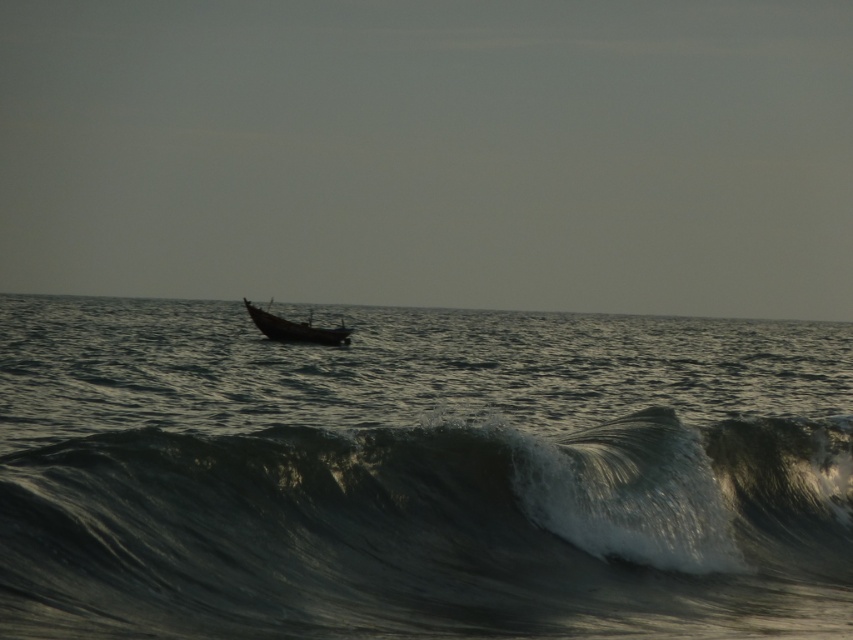
Question: Can you confirm if shiny dark gray wave at center is positioned to the right of dark matte boat at center?

Choices:
 (A) no
 (B) yes

Answer: (B)

Question: Can you confirm if shiny dark gray wave at center is thinner than dark matte boat at center?

Choices:
 (A) no
 (B) yes

Answer: (A)

Question: Among these objects, which one is nearest to the camera?

Choices:
 (A) dark matte boat at center
 (B) shiny dark gray wave at center

Answer: (B)

Question: Does shiny dark gray wave at center have a smaller size compared to dark matte boat at center?

Choices:
 (A) no
 (B) yes

Answer: (A)

Question: Which of the following is the farthest from the observer?

Choices:
 (A) (643, 442)
 (B) (274, 320)

Answer: (B)